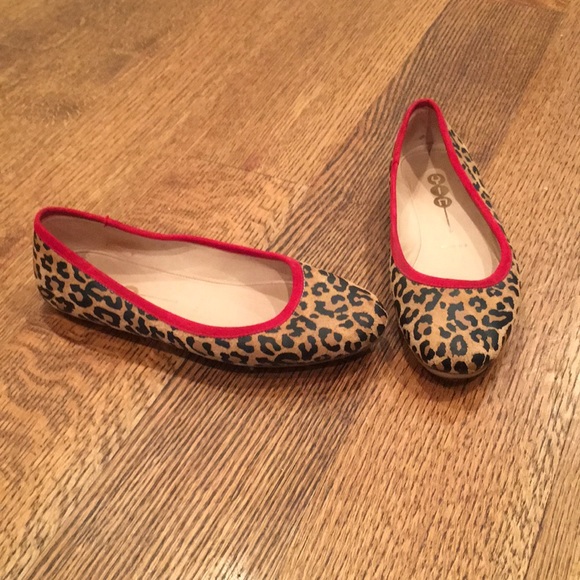
The width and height of the screenshot is (580, 580). In order to click on light wood in this screenshot , I will do `click(231, 117)`.